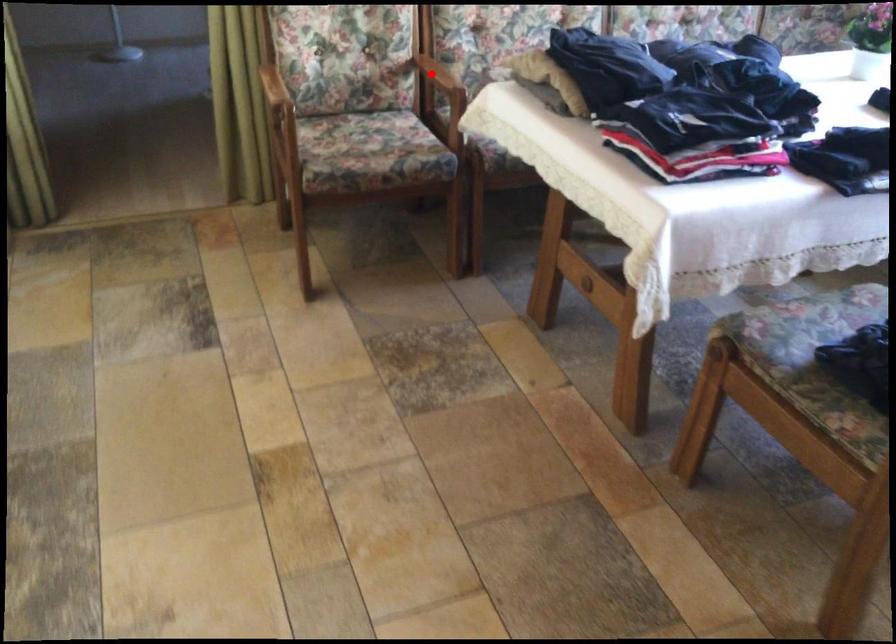
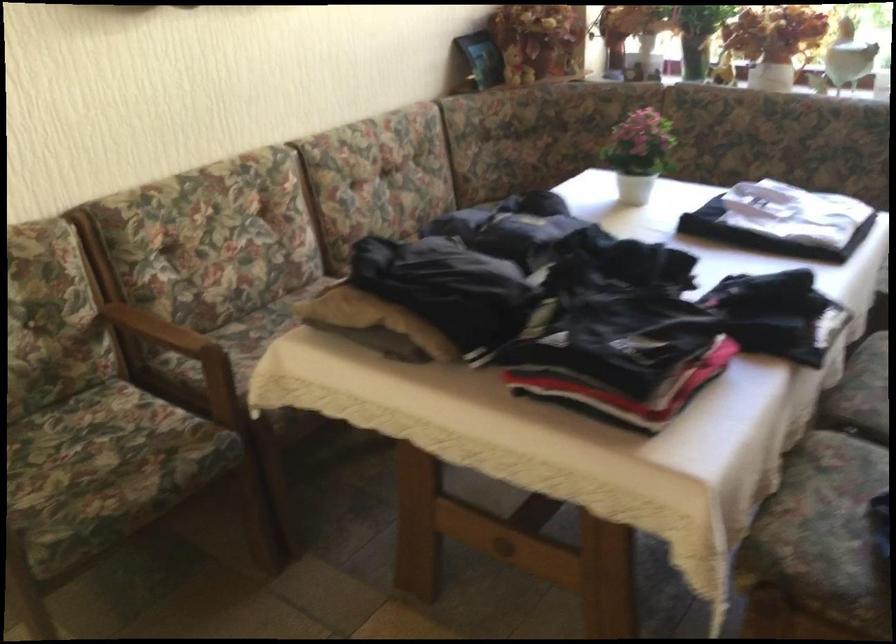
Question: I am providing you with two images of the same scene from different viewpoints. In image1, a red point is highlighted. Considering the same 3D point in image2, which of the following is correct?

Choices:
 (A) It is closer
 (B) It is farther

Answer: (A)